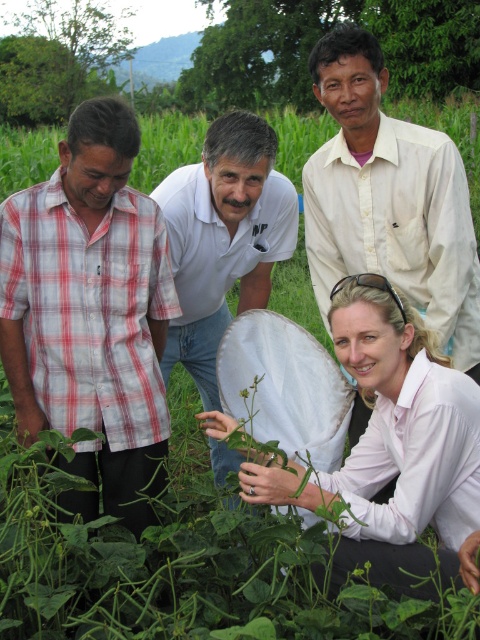
You are planning to take a photo of the red plaid shirt at left and the white shirt at upper center. Which one should you zoom in more on to capture both shirts in the frame without cropping?

You should zoom in more on the red plaid shirt at left because it has a lesser width compared to the white shirt at upper center, so focusing on the wider shirt might cause it to be cropped out.

You are a photographer trying to capture a group photo of the red plaid shirt at left and the white smooth shirt at center. Given that your camera has a minimum focus distance of 16 inches, will you be able to focus on both subjects simultaneously?

The red plaid shirt at left and white smooth shirt at center are 16.30 inches apart. Since the distance between them is slightly over 16 inches, the camera can focus on both subjects as the separation meets the minimum focus distance requirement.

You are a photographer trying to capture a clear shot of the white shirt at upper center and the white smooth shirt at center. Since the camera can only focus on one subject at a time, which shirt should you focus on first if you want to include both in the frame?

The white shirt at upper center is to the right of the white smooth shirt at center, so you should focus on the white smooth shirt at center first as it is closer to the left side, allowing the camera to capture both shirts in the frame by positioning the focus on the nearest subject.